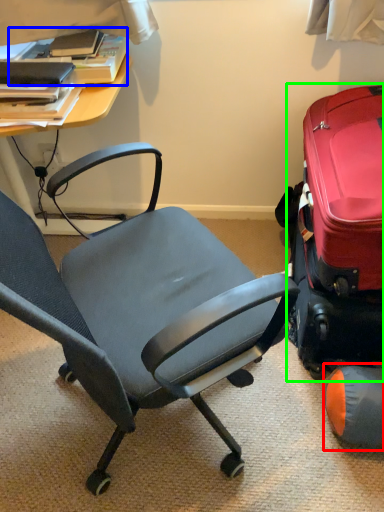
Question: Which object is the farthest from bean bag chair (highlighted by a red box)? Choose among these: book (highlighted by a blue box) or suitcase (highlighted by a green box).

Choices:
 (A) book
 (B) suitcase

Answer: (A)